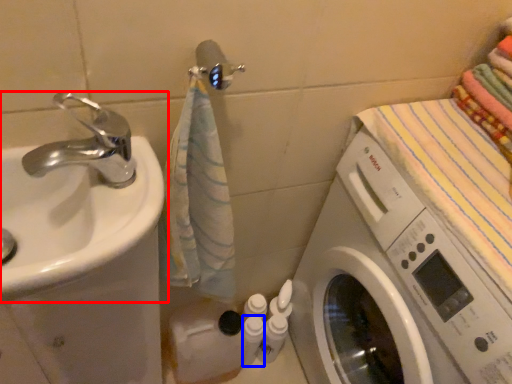
Question: Which point is closer to the camera, sink (highlighted by a red box) or toiletry (highlighted by a blue box)?

Choices:
 (A) sink
 (B) toiletry

Answer: (A)